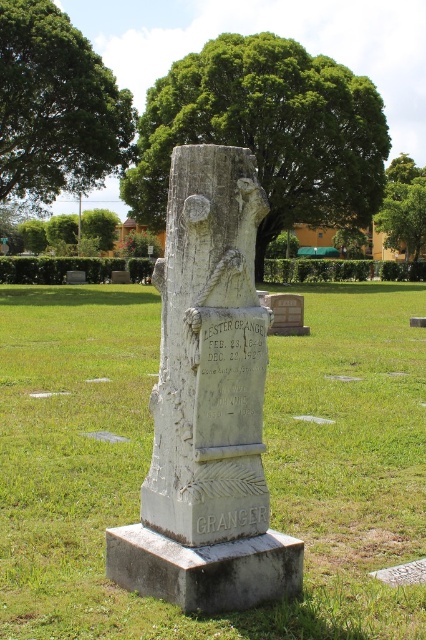
You are standing at the point marked by the coordinates point [264,461] in the image. What is the terrain like under your feet?

The point [264,461] is on green grass at center, so the terrain under your feet is grassy.

You are a gardener assessing the cemetery layout. You need to trim the green leafy tree at center and the green leafy tree at upper right. Which tree requires more horizontal space for its branches?

The green leafy tree at center requires more horizontal space for its branches since its width surpasses that of the green leafy tree at upper right.